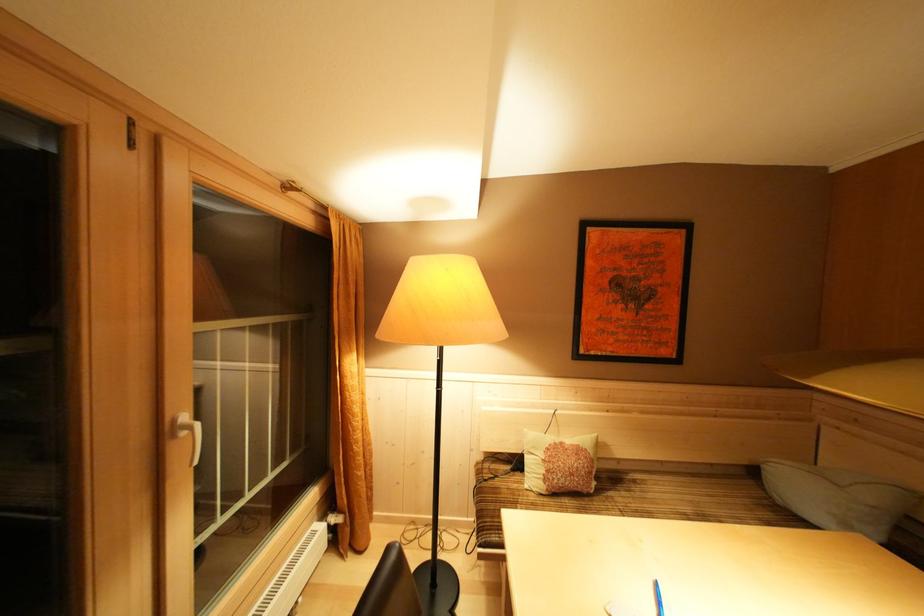
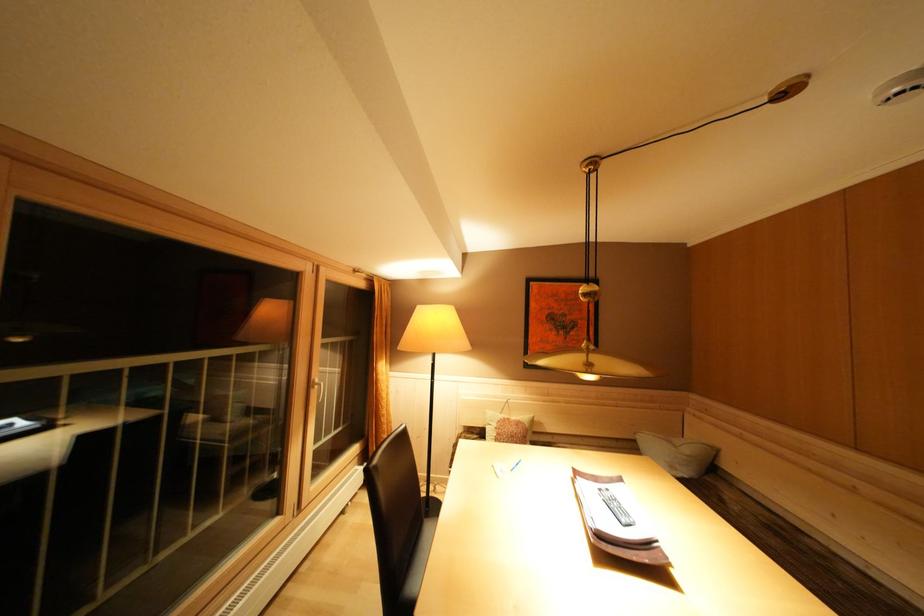
Where in the second image is the point corresponding to point 568,448 from the first image?

(515, 424)